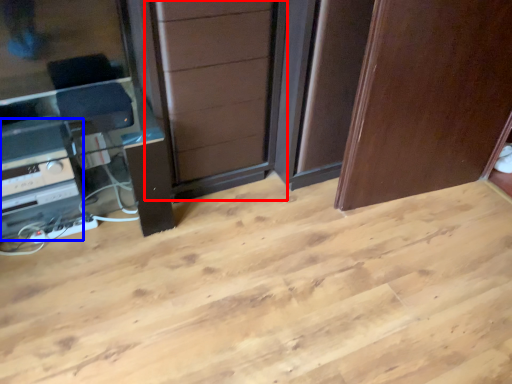
Question: Among these objects, which one is farthest to the camera, screen door (highlighted by a red box) or appliance (highlighted by a blue box)?

Choices:
 (A) screen door
 (B) appliance

Answer: (B)